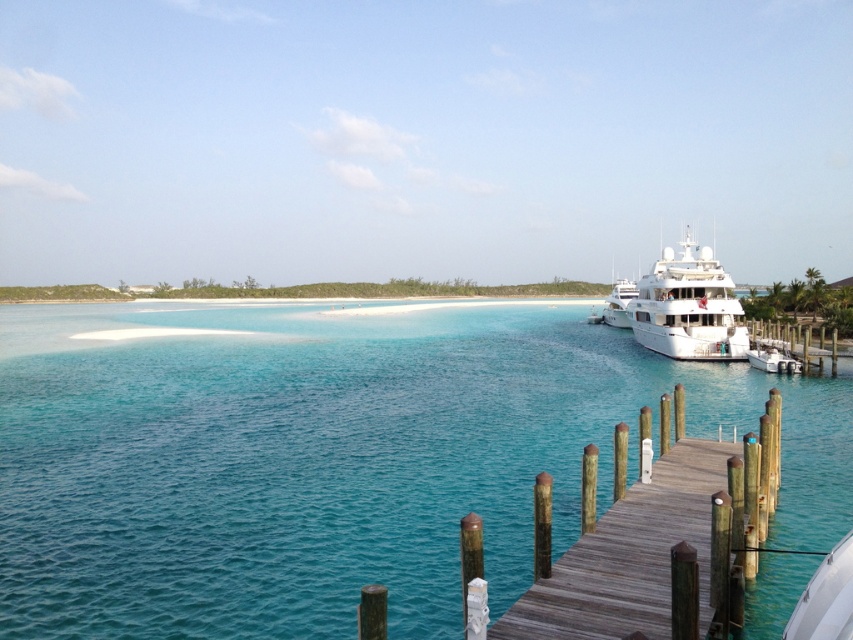
Is point (352, 385) in front of point (683, 282)?

Yes, it is.

Is turquoise water at center closer to the viewer compared to white glossy cruise ship at right?

Yes, it is in front of white glossy cruise ship at right.

Measure the distance between turquoise water at center and camera.

A distance of 6.90 meters exists between turquoise water at center and camera.

Locate an element on the screen. This screenshot has height=640, width=853. turquoise water at center is located at coordinates (335, 458).

Which is in front, point (585, 540) or point (672, 291)?

Positioned in front is point (585, 540).

The image size is (853, 640). What do you see at coordinates (630, 556) in the screenshot? I see `wooden dock at lower right` at bounding box center [630, 556].

Is point (706, 438) more distant than point (734, 301)?

No, it is in front of (734, 301).

Where is `wooden dock at lower right`? This screenshot has width=853, height=640. wooden dock at lower right is located at coordinates (630, 556).

Is point (88, 618) positioned behind point (659, 605)?

Yes, point (88, 618) is farther from viewer.

Which is more to the left, turquoise water at center or wooden dock at lower right?

From the viewer's perspective, turquoise water at center appears more on the left side.

Between point (270, 321) and point (622, 586), which one is positioned behind?

Positioned behind is point (270, 321).

The height and width of the screenshot is (640, 853). I want to click on turquoise water at center, so click(335, 458).